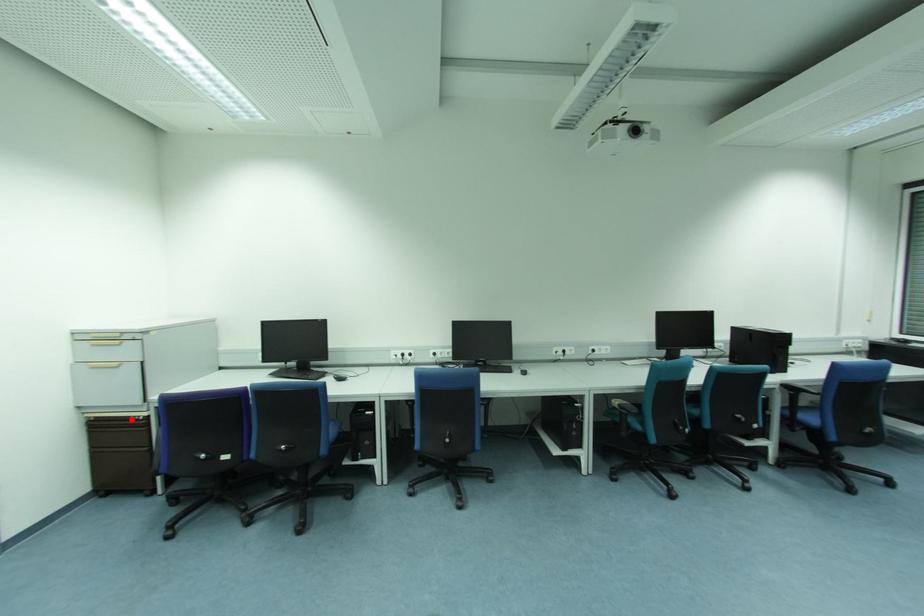
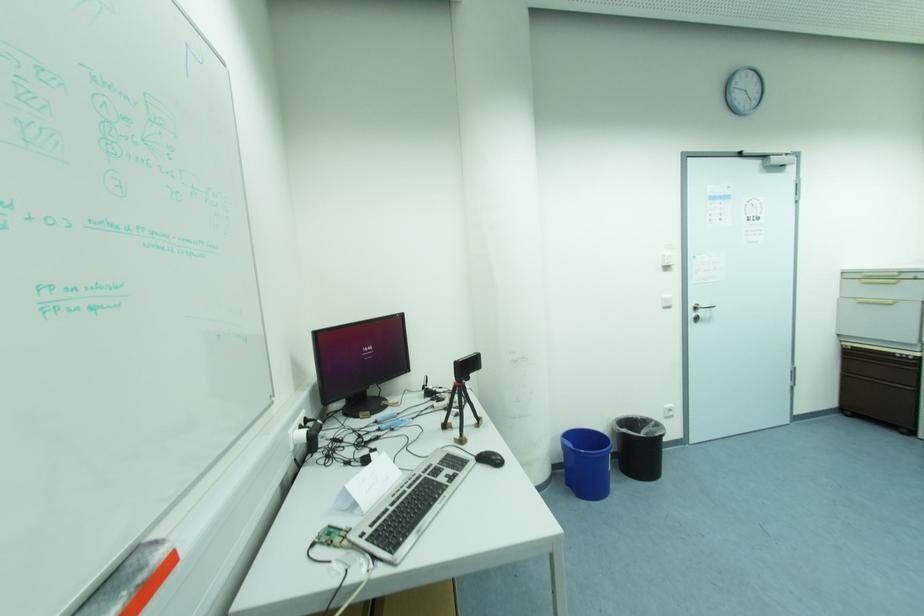
Locate, in the second image, the point that corresponds to the highlighted location in the first image.

(898, 355)